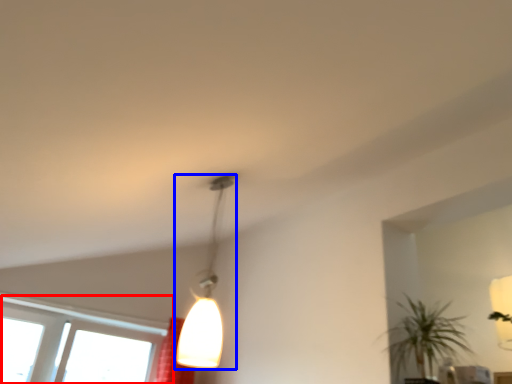
Question: Which object appears closest to the camera in this image, window (highlighted by a red box) or lamp (highlighted by a blue box)?

Choices:
 (A) window
 (B) lamp

Answer: (B)